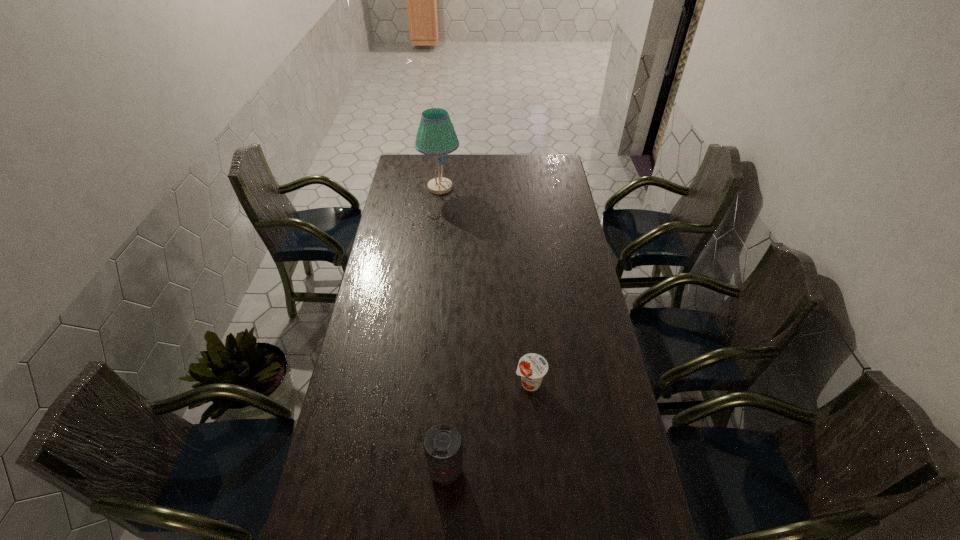
This screenshot has width=960, height=540. I want to click on free area in between the second object from right to left and the telephoto lens, so point(488,427).

This screenshot has width=960, height=540. What are the coordinates of `free space between the lamp and the second tallest object` in the screenshot? It's located at (444, 329).

Point out which object is positioned as the nearest to the taller yogurt. Please provide its 2D coordinates. Your answer should be formatted as a tuple, i.e. [(x, y)], where the tuple contains the x and y coordinates of a point satisfying the conditions above.

[(442, 444)]

Find the location of a particular element. the closest object to the nearest object is located at coordinates (442, 444).